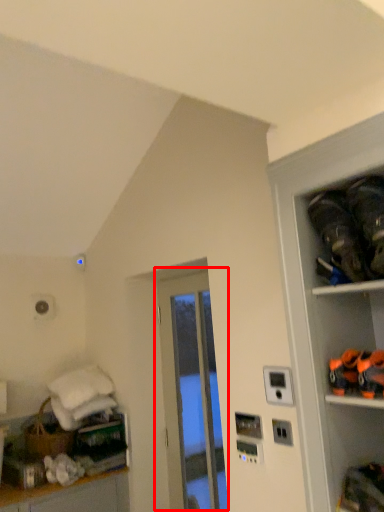
Question: From the image, what is the correct spatial relationship of door (annotated by the red box) in relation to shelf?

Choices:
 (A) left
 (B) right

Answer: (A)